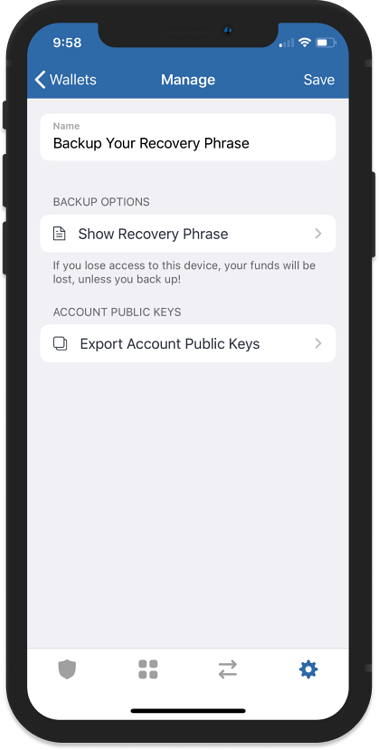
At what (x,y) coordinates should I click in order to perform the action: click on speaker. Please return your answer as a coordinate pair (x, y). The width and height of the screenshot is (379, 750). Looking at the image, I should click on (191, 28).